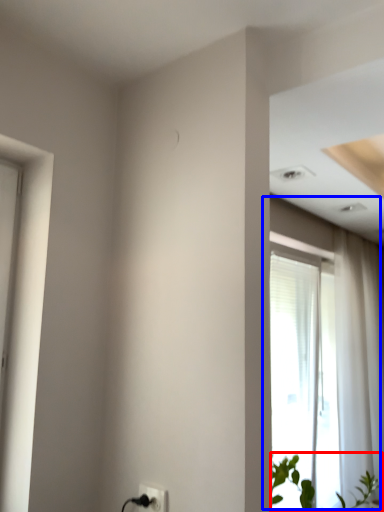
Question: Which of the following is the farthest to the observer, houseplant (highlighted by a red box) or window (highlighted by a blue box)?

Choices:
 (A) houseplant
 (B) window

Answer: (B)